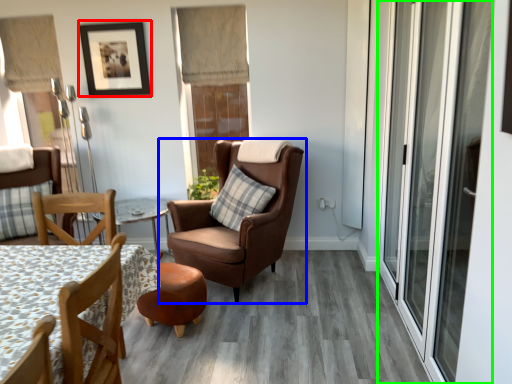
Question: Estimate the real-world distances between objects in this image. Which object is closer to picture frame (highlighted by a red box), chair (highlighted by a blue box) or screen door (highlighted by a green box)?

Choices:
 (A) chair
 (B) screen door

Answer: (A)